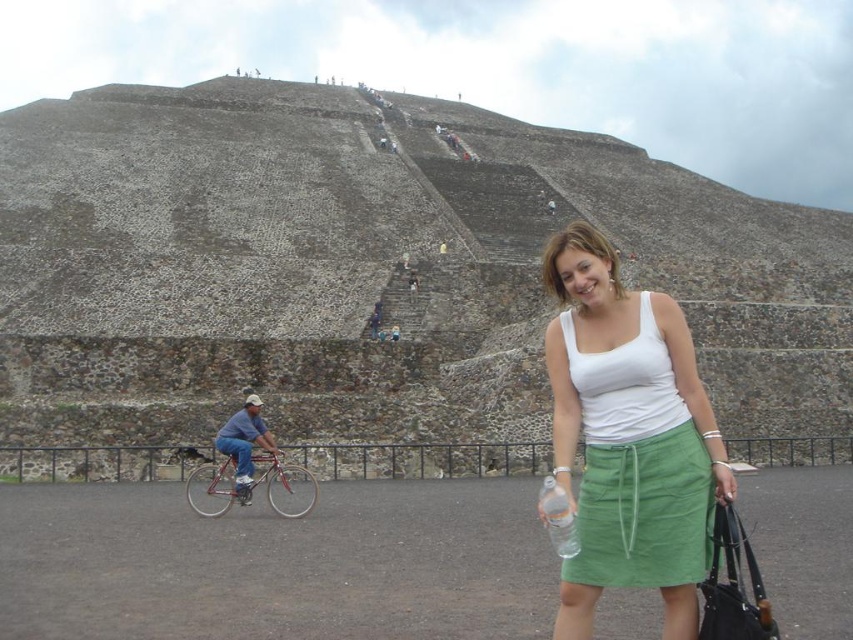
Question: Among these points, which one is nearest to the camera?

Choices:
 (A) (560, 477)
 (B) (271, 484)

Answer: (A)

Question: Which of the following is the farthest from the observer?

Choices:
 (A) (241, 493)
 (B) (566, 515)
 (C) (651, 324)

Answer: (A)

Question: Is white cotton tank top at center below shiny red bicycle at left?

Choices:
 (A) no
 (B) yes

Answer: (A)

Question: Does shiny red bicycle at left appear on the left side of clear plastic bottle at center?

Choices:
 (A) yes
 (B) no

Answer: (A)

Question: Which point is closer to the camera?

Choices:
 (A) (624, 525)
 (B) (235, 493)

Answer: (A)

Question: Can you confirm if shiny red bicycle at left is positioned to the left of clear plastic bottle at center?

Choices:
 (A) no
 (B) yes

Answer: (B)